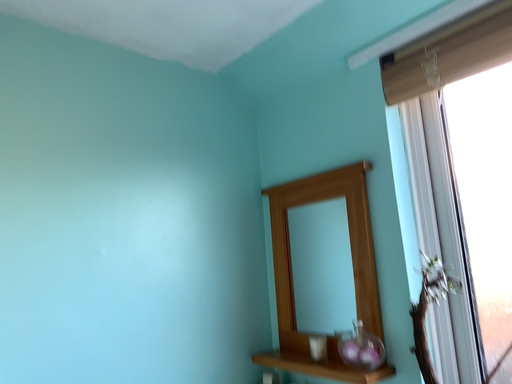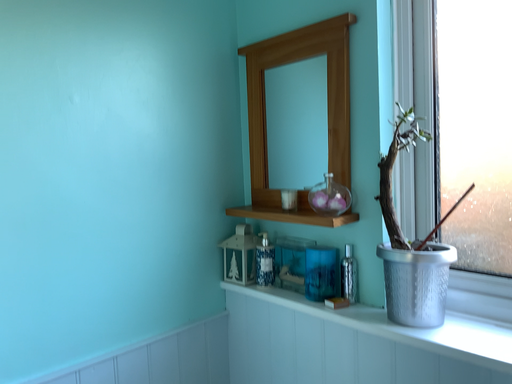
Question: How did the camera likely rotate when shooting the video?

Choices:
 (A) rotated downward
 (B) rotated upward

Answer: (A)